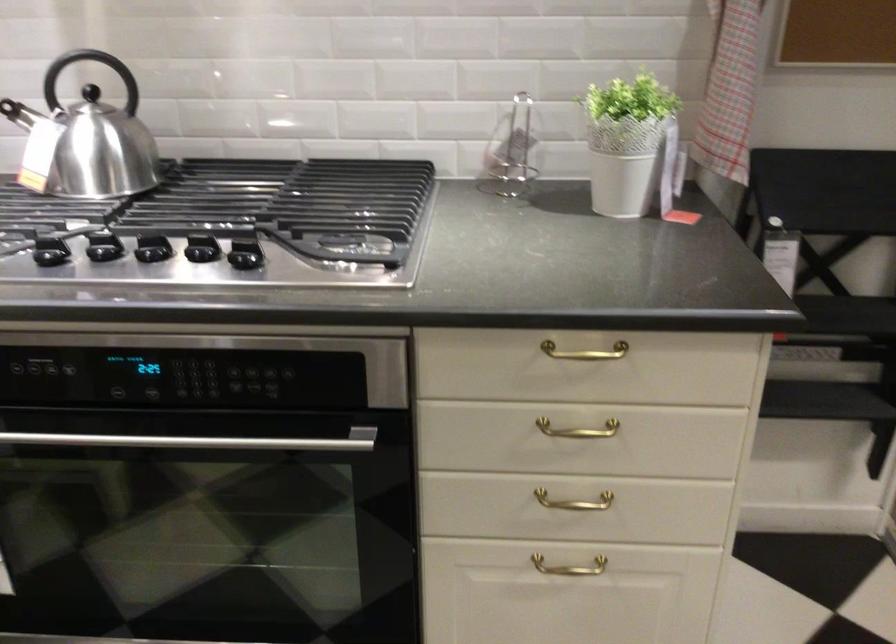
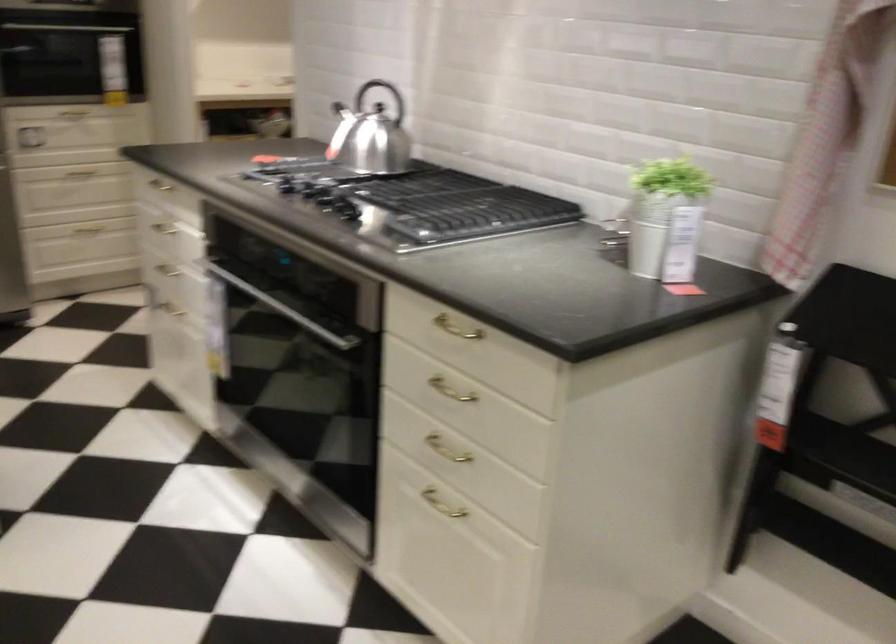
The point at (561, 431) is marked in the first image. Where is the corresponding point in the second image?

(450, 390)